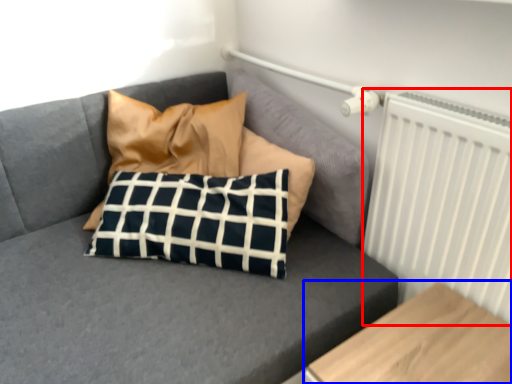
Question: Which object appears closest to the camera in this image, radiator (highlighted by a red box) or furniture (highlighted by a blue box)?

Choices:
 (A) radiator
 (B) furniture

Answer: (B)